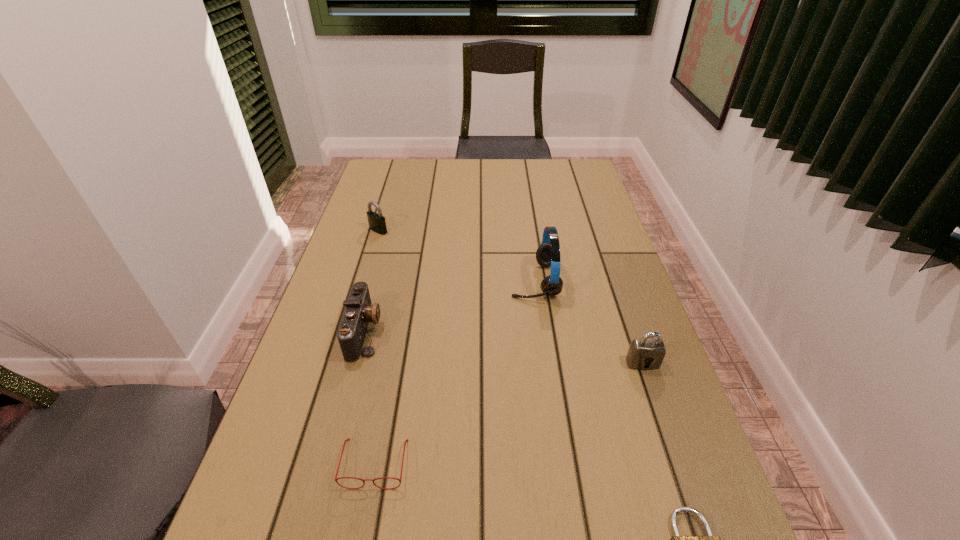
Identify which padlock is the nearest to the camera. Please provide its 2D coordinates. Your answer should be formatted as a tuple, i.e. [(x, y)], where the tuple contains the x and y coordinates of a point satisfying the conditions above.

[(377, 223)]

Identify which padlock is the nearest to the spectacles. Please provide its 2D coordinates. Your answer should be formatted as a tuple, i.e. [(x, y)], where the tuple contains the x and y coordinates of a point satisfying the conditions above.

[(677, 539)]

The height and width of the screenshot is (540, 960). In order to click on vacant area in the image that satisfies the following two spatial constraints: 1. with the microphone attached to the side of the fifth nearest object; 2. on the face of the second shortest object in this screenshot , I will do pyautogui.click(x=560, y=463).